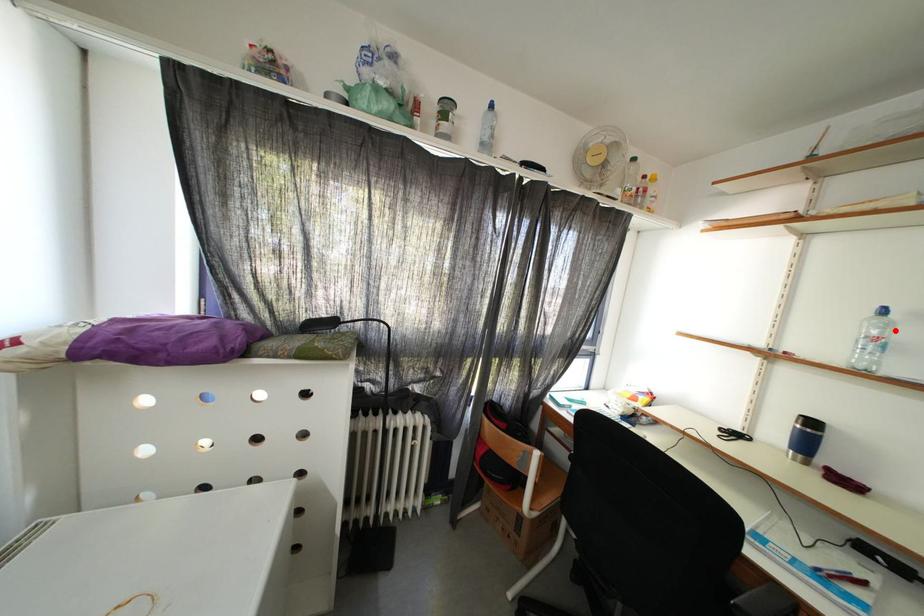
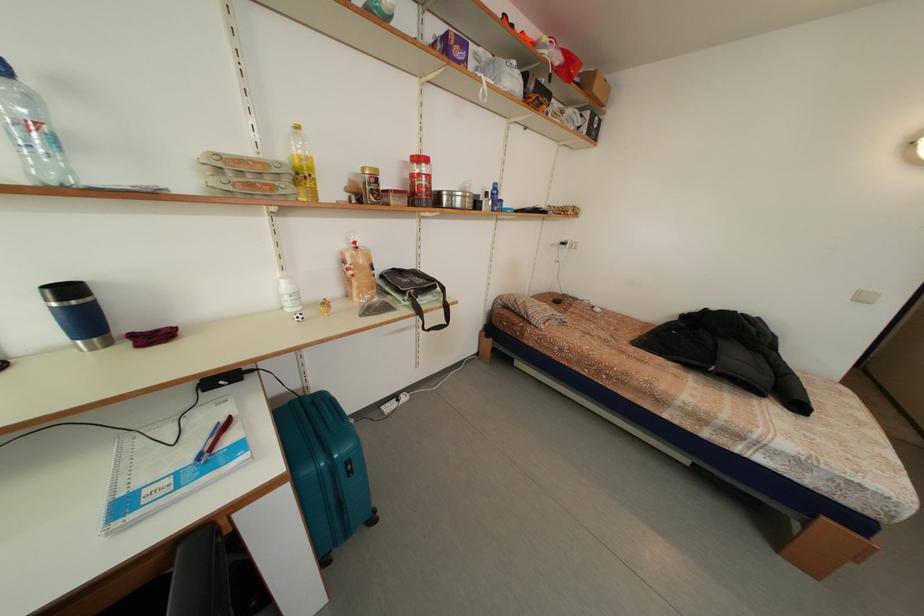
Question: I am providing you with two images of the same scene from different viewpoints. Image1 has a red point marked. In image2, the corresponding 3D location appears at what relative position? Reply with the corresponding letter.

Choices:
 (A) Closer
 (B) Farther

Answer: (B)